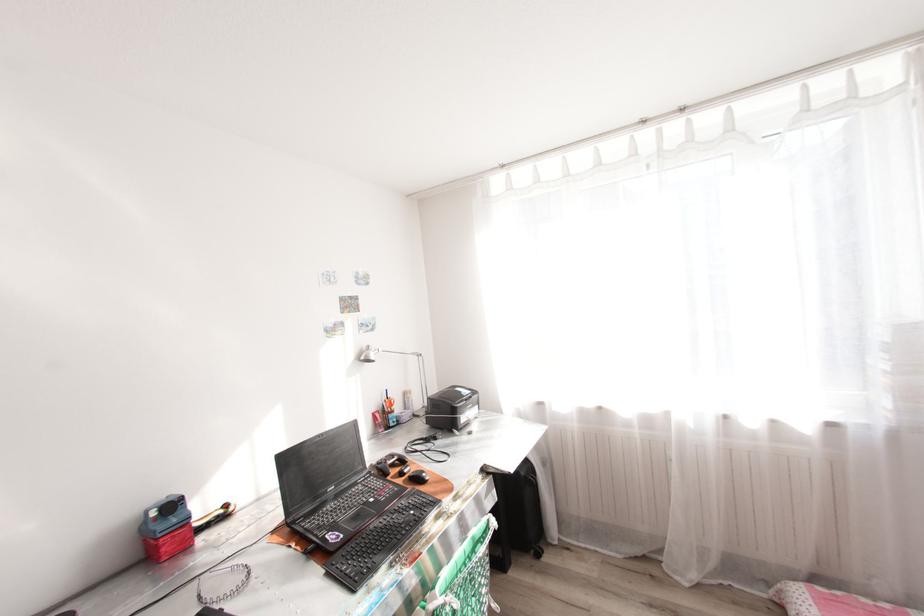
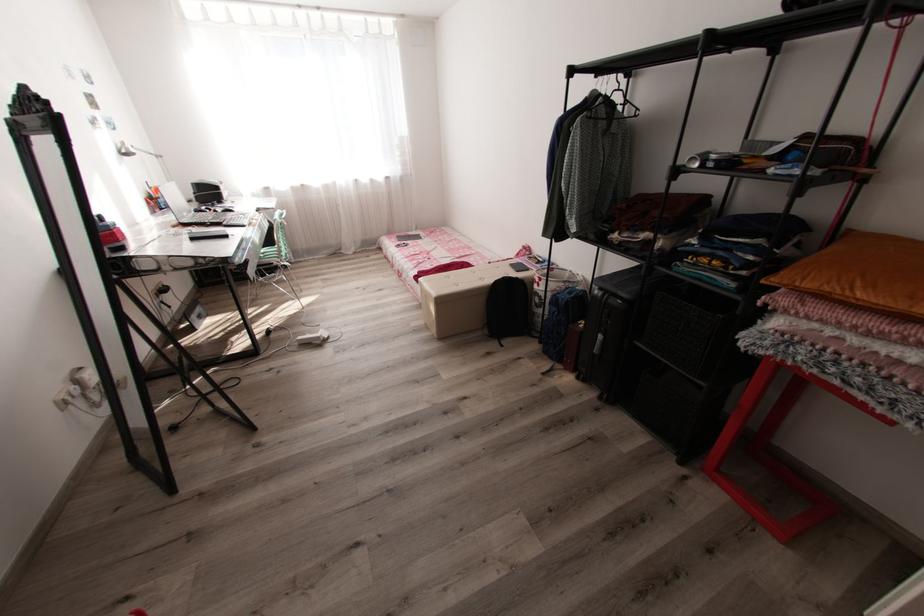
In the second image, find the point that corresponds to the point at 396,424 in the first image.

(167, 207)